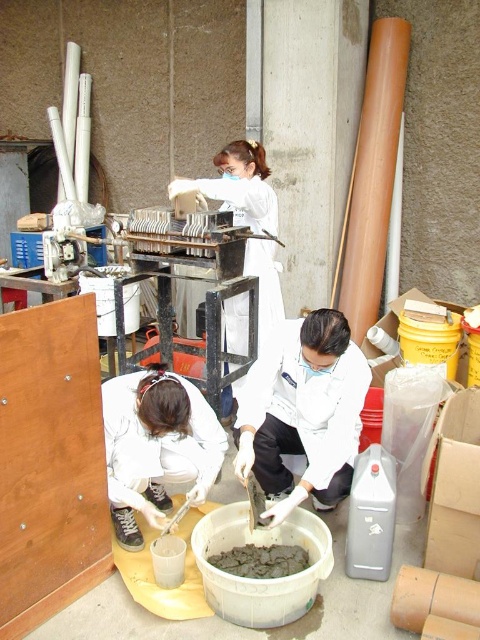
Is white matte lab coat at lower left shorter than gray matte concrete at center?

No.

Between white matte lab coat at lower left and gray matte concrete at center, which one appears on the right side from the viewer's perspective?

gray matte concrete at center

Where is `white matte lab coat at lower left`? This screenshot has width=480, height=640. white matte lab coat at lower left is located at coordinates (156, 445).

Find the location of `white matte lab coat at lower left`. white matte lab coat at lower left is located at coordinates (156, 445).

Can you confirm if white matte lab coat at center is positioned to the left of white matte lab coat at lower left?

No, white matte lab coat at center is not to the left of white matte lab coat at lower left.

Locate an element on the screen. This screenshot has width=480, height=640. white matte lab coat at center is located at coordinates (302, 412).

Can you confirm if white matte lab coat at center is positioned below gray matte concrete at center?

Actually, white matte lab coat at center is above gray matte concrete at center.

Based on the photo, who is more distant from viewer, (237, 445) or (239, 563)?

The point (237, 445) is behind.

Where is `white matte lab coat at center`? This screenshot has height=640, width=480. white matte lab coat at center is located at coordinates (302, 412).